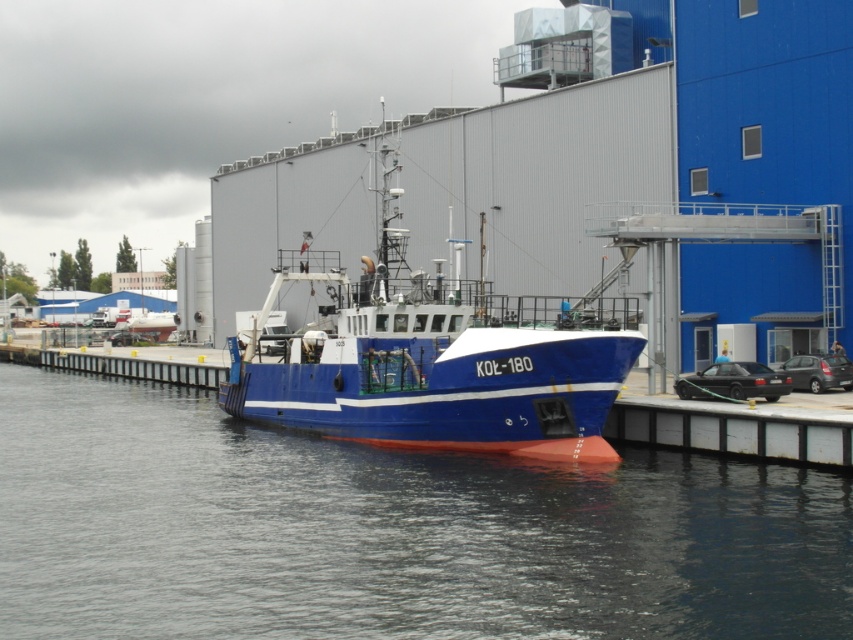
You are a crane operator at the port and need to move a container from one location to another. The first location is marked by point (689, 500) and the second by point (386, 365). From your vantage point, which point is closer to you?

Point (689, 500) is in front of point (386, 365), so it is closer to you.

You are standing on the pier and see the blue glossy water at center and the blue matte boat at center. Which object is positioned to the right of the other?

The blue glossy water at center is to the right of the blue matte boat at center.

You are a marine biologist observing the scene from the pier. You notice the blue glossy water at center and the blue matte boat at center. Which object appears larger in the image?

The blue matte boat at center appears larger than the blue glossy water at center.